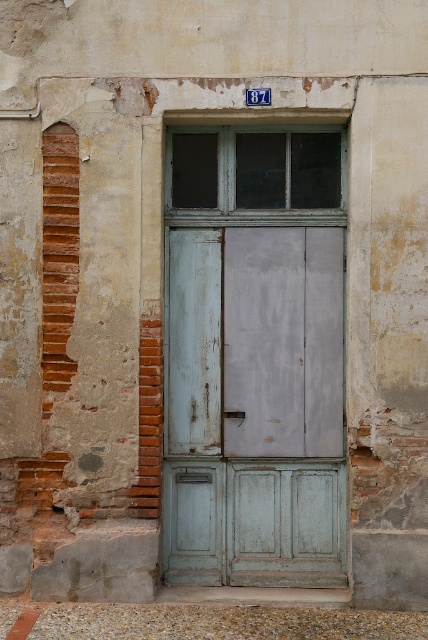
Does light blue wooden door at center have a greater width compared to matte gray wooden window at center?

Yes, light blue wooden door at center is wider than matte gray wooden window at center.

Measure the distance from light blue wooden door at center to matte gray wooden window at center.

light blue wooden door at center and matte gray wooden window at center are 28.12 inches apart.

Measure the distance between light blue wooden door at center and camera.

22.89 feet

Locate an element on the screen. light blue wooden door at center is located at coordinates (255, 406).